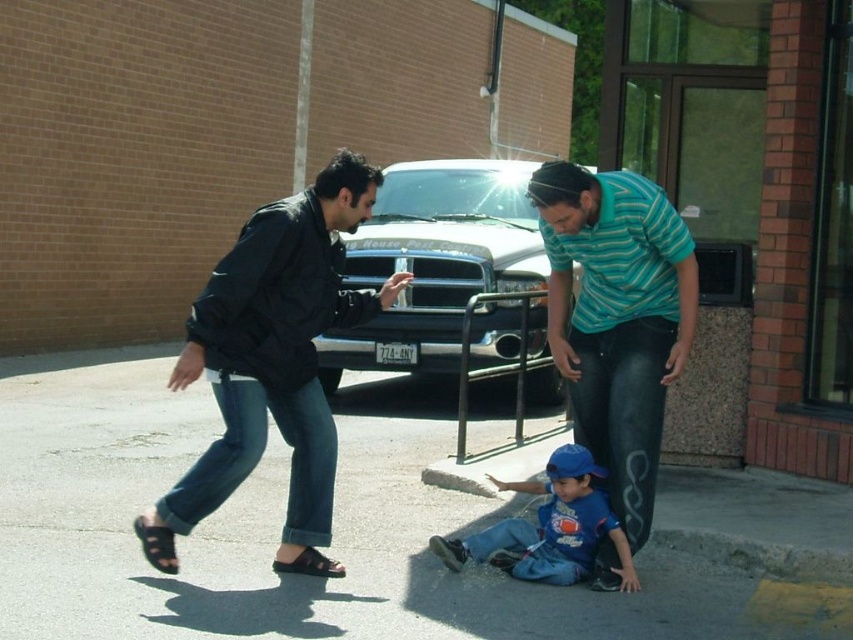
Question: Which object appears closest to the camera in this image?

Choices:
 (A) concrete curb at lower center
 (B) black rubber sandal at lower left
 (C) gray asphalt at center

Answer: (A)

Question: Does blue cotton shirt at lower center lie behind black fabric sandal at lower left?

Choices:
 (A) no
 (B) yes

Answer: (B)

Question: Is gray asphalt at center bigger than black leather jacket at center?

Choices:
 (A) yes
 (B) no

Answer: (B)

Question: Which object is farther from the camera taking this photo?

Choices:
 (A) gray asphalt at center
 (B) teal striped shirt at center

Answer: (A)

Question: Does black leather jacket at center lie behind black rubber sandal at lower left?

Choices:
 (A) no
 (B) yes

Answer: (A)

Question: Which object is the farthest from the black leather jacket at center?

Choices:
 (A) concrete curb at lower center
 (B) shiny black truck at center
 (C) black rubber sandal at lower left

Answer: (B)